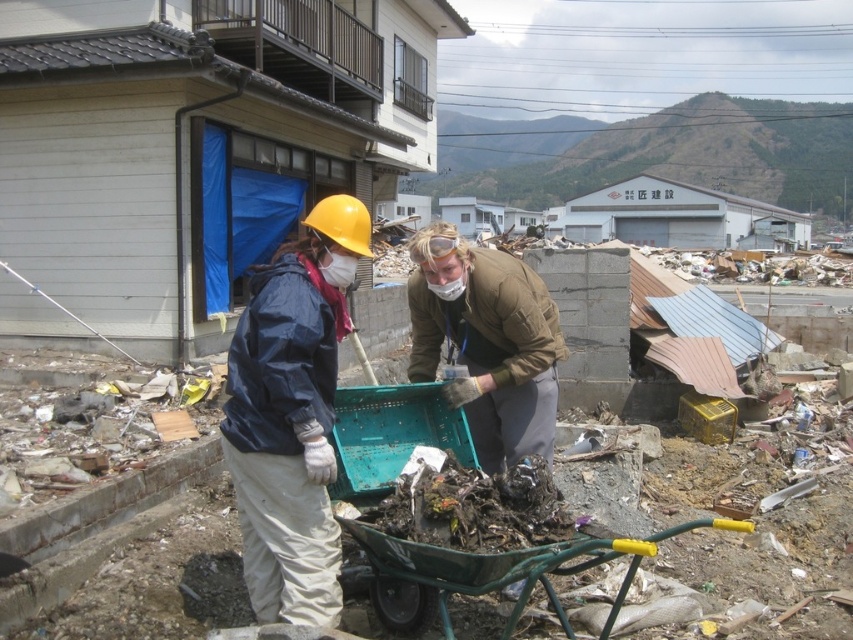
You are part of the cleanup crew and need to determine if the matte yellow hard hat at center can be placed inside the green plastic cart at lower center based on their sizes. Can it fit?

The matte yellow hard hat at center has a smaller width than the green plastic cart at lower center, so it can fit inside.

Based on the photo, you are a volunteer at the disaster site and need to determine which item is smaller between the matte yellow hard hat at center and the green plastic cart at lower center. Which one is it?

The matte yellow hard hat at center is smaller than the green plastic cart at lower center.

You are a volunteer at the disaster cleanup site. You need to move the brown leather jacket at center and the green plastic cart at lower center to a storage area. Which object should you move first if you want to carry the lighter item first?

The brown leather jacket at center has a smaller size compared to the green plastic cart at lower center, so it is likely lighter. Therefore, you should move the brown leather jacket at center first.